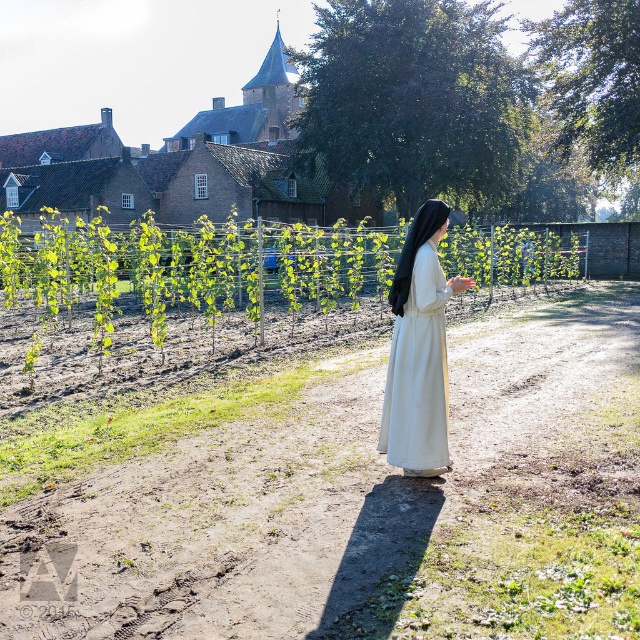
Question: Is green leafy vine at center above white cotton dress at center?

Choices:
 (A) yes
 (B) no

Answer: (A)

Question: Which object is farther from the camera taking this photo?

Choices:
 (A) green leafy vine at center
 (B) white cotton dress at center

Answer: (B)

Question: From the image, what is the correct spatial relationship of green leafy vine at center in relation to white cotton dress at center?

Choices:
 (A) right
 (B) left

Answer: (B)

Question: Is green leafy vine at center above white cotton dress at center?

Choices:
 (A) no
 (B) yes

Answer: (B)

Question: Which point appears closest to the camera in this image?

Choices:
 (A) (332, 284)
 (B) (403, 285)

Answer: (B)